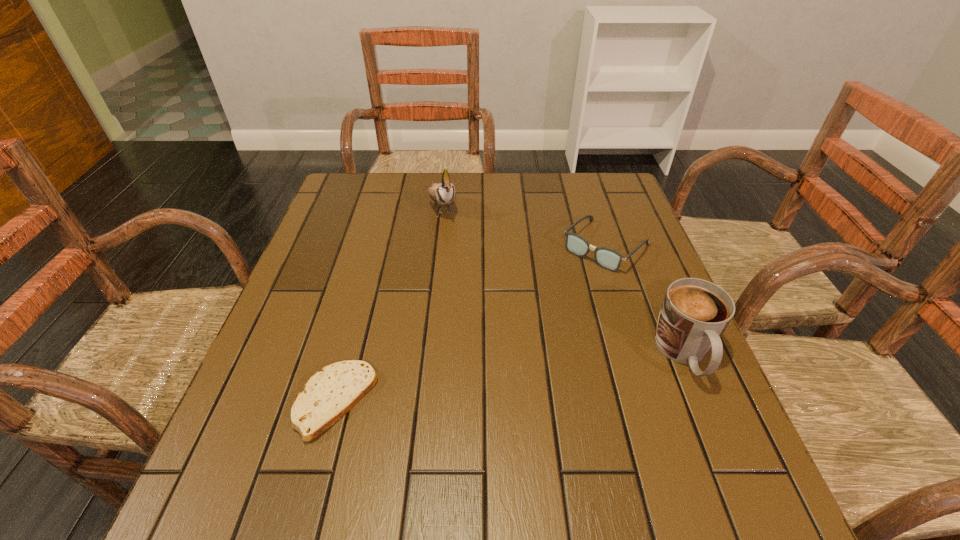
This screenshot has height=540, width=960. I want to click on free location at the near edge of the desktop, so click(344, 425).

The height and width of the screenshot is (540, 960). In order to click on vacant space at the left edge in this screenshot , I will do `click(378, 219)`.

I want to click on free space at the right edge of the desktop, so click(618, 312).

Locate an element on the screen. The height and width of the screenshot is (540, 960). free space at the far left corner of the desktop is located at coordinates (324, 211).

Where is `free location at the near left corner of the desktop`? This screenshot has width=960, height=540. free location at the near left corner of the desktop is located at coordinates (240, 435).

Identify the location of vacant space at the far right corner of the desktop. (594, 210).

Locate an element on the screen. This screenshot has height=540, width=960. free space between the pita bread and the second object from left to right is located at coordinates 389,303.

The image size is (960, 540). In order to click on vacant area that lies between the pita bread and the spectacles in this screenshot , I will do `click(470, 323)`.

The image size is (960, 540). In order to click on free space between the second tallest object and the tallest object in this screenshot , I will do `click(564, 280)`.

What are the coordinates of `free space between the second object from left to right and the pita bread` in the screenshot? It's located at (389, 303).